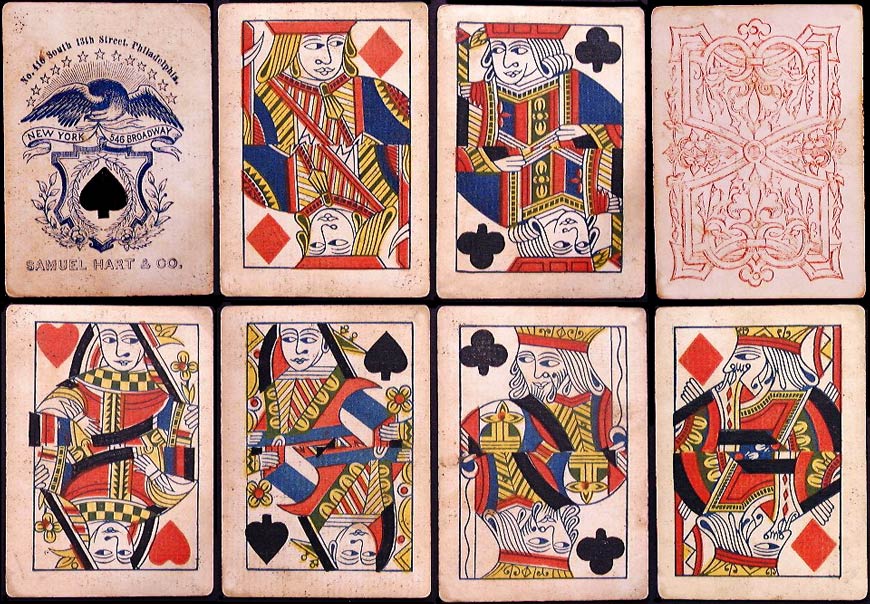
Image resolution: width=870 pixels, height=604 pixels. Find the location of `playing cards`. playing cards is located at coordinates pyautogui.click(x=157, y=187), pyautogui.click(x=323, y=150), pyautogui.click(x=545, y=138), pyautogui.click(x=771, y=130), pyautogui.click(x=747, y=414), pyautogui.click(x=513, y=426), pyautogui.click(x=337, y=441), pyautogui.click(x=135, y=426).